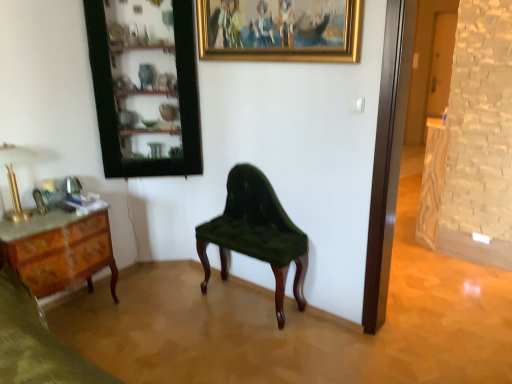
Where is `vacant area that is in front of velvet green chair at center`? The width and height of the screenshot is (512, 384). vacant area that is in front of velvet green chair at center is located at coordinates (247, 347).